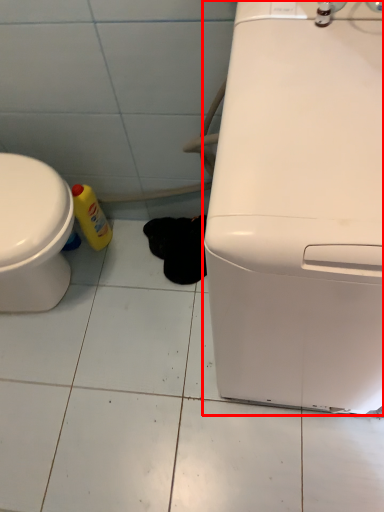
Question: Observing the image, what is the correct spatial positioning of home appliance (annotated by the red box) in reference to bottle?

Choices:
 (A) right
 (B) left

Answer: (A)